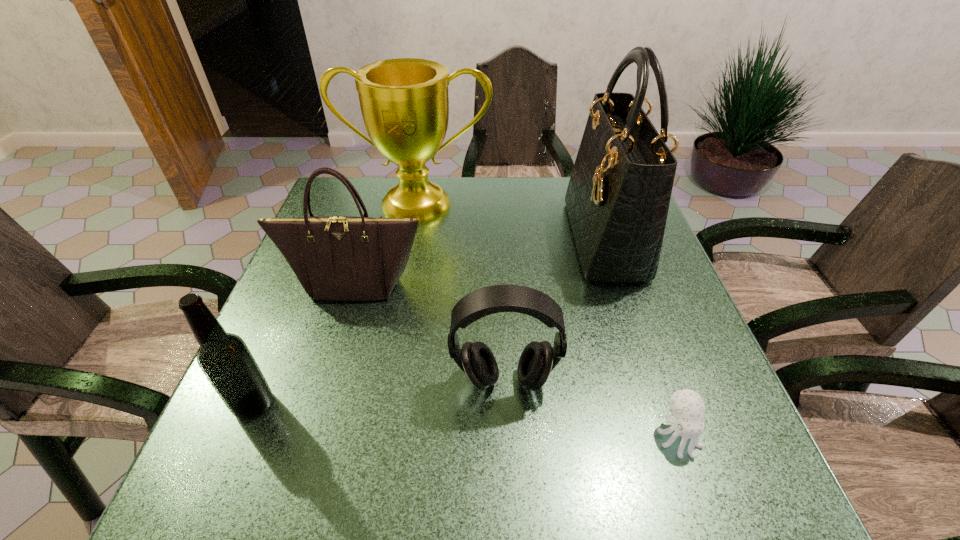
The image size is (960, 540). In order to click on beer bottle at the left edge in this screenshot , I will do tap(224, 358).

Identify the location of handbag positioned at the right edge. This screenshot has width=960, height=540. (618, 196).

The width and height of the screenshot is (960, 540). In order to click on octopus present at the right edge in this screenshot , I will do `click(687, 406)`.

The height and width of the screenshot is (540, 960). Identify the location of object located in the far left corner section of the desktop. (404, 102).

This screenshot has height=540, width=960. What are the coordinates of `object at the far right corner` in the screenshot? It's located at (618, 196).

Where is `object that is positioned at the near right corner`? The image size is (960, 540). object that is positioned at the near right corner is located at coordinates click(x=687, y=406).

Identify the location of vacant space at the far edge. The image size is (960, 540). (557, 196).

The image size is (960, 540). In the image, there is a desktop. In order to click on vacant space at the near edge in this screenshot , I will do `click(439, 497)`.

Find the location of a particular element. This screenshot has width=960, height=540. vacant space at the left edge of the desktop is located at coordinates (245, 421).

The width and height of the screenshot is (960, 540). Identify the location of blank space at the right edge. (660, 314).